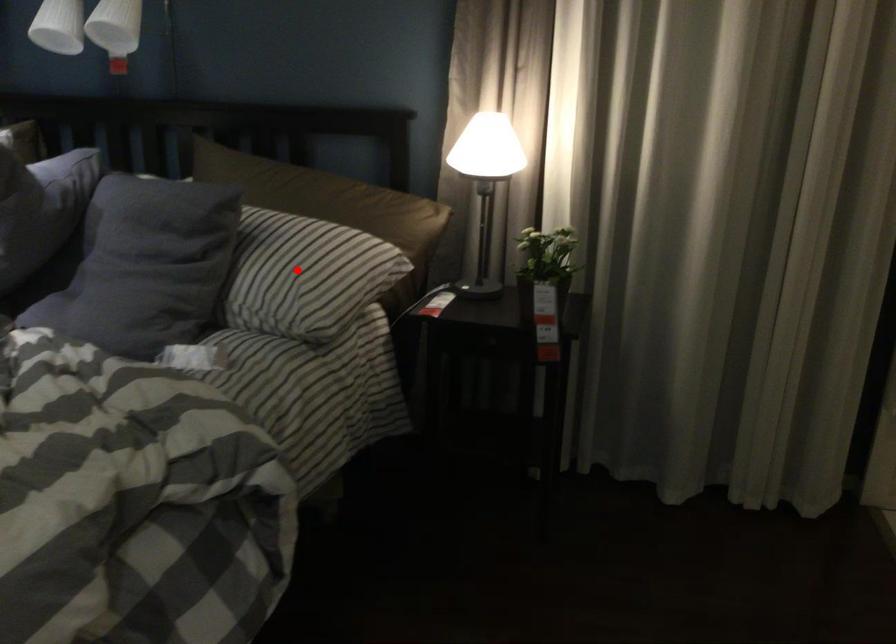
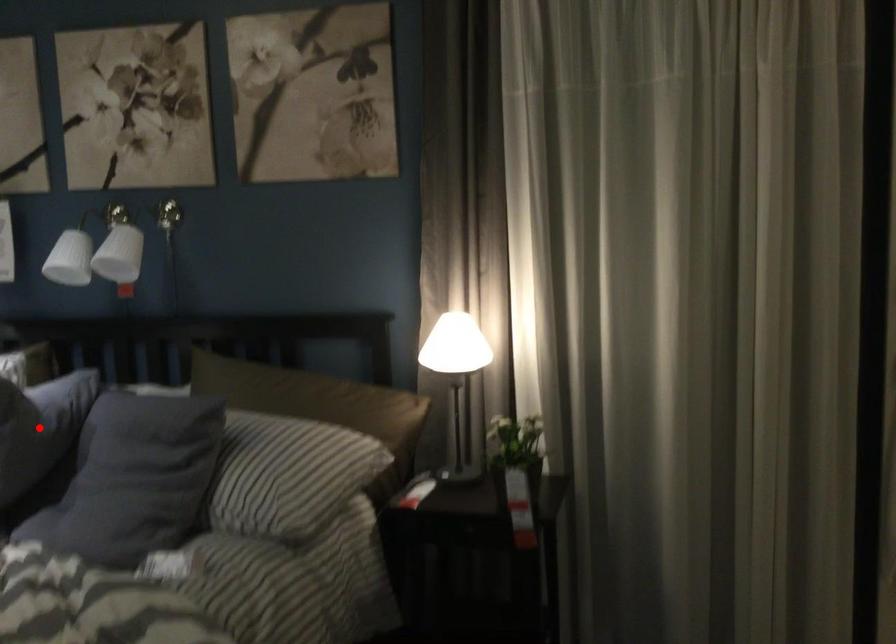
I am providing you with two images of the same scene from different viewpoints. A red point is marked on the first image and another point is marked on the second image. Do the highlighted points in image1 and image2 indicate the same real-world spot?

No